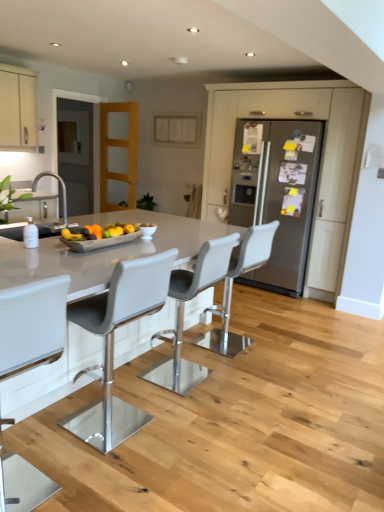
Image resolution: width=384 pixels, height=512 pixels. I want to click on blank area beneath white leather bar stool at center, acting as the 3th chair starting from the front (from a real-world perspective), so click(185, 376).